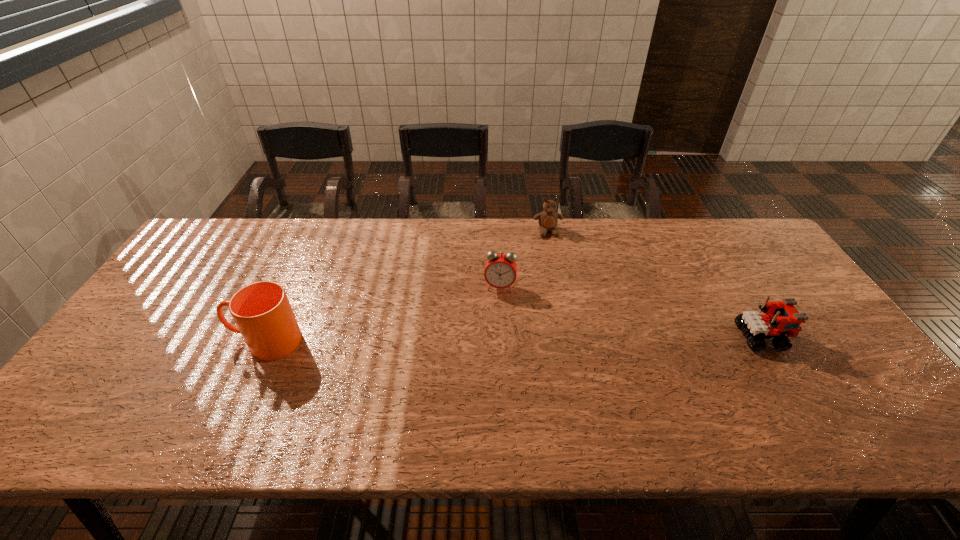
I want to click on mug, so click(262, 312).

This screenshot has height=540, width=960. Find the location of `the leftmost object`. the leftmost object is located at coordinates (262, 312).

The width and height of the screenshot is (960, 540). Find the location of `the rightmost object`. the rightmost object is located at coordinates (782, 318).

Where is `the third object from right to left`? the third object from right to left is located at coordinates (500, 272).

Where is `the third nearest object`? This screenshot has width=960, height=540. the third nearest object is located at coordinates (500, 272).

This screenshot has width=960, height=540. Find the location of `the second object from right to left`. the second object from right to left is located at coordinates (548, 219).

Find the location of `the farthest object`. the farthest object is located at coordinates coord(548,219).

This screenshot has height=540, width=960. Identify the location of free space located on the handle side of the leftmost object. (188, 341).

Find the location of a particular element. The height and width of the screenshot is (540, 960). vacant space situated 0.100m on the handle side of the leftmost object is located at coordinates (192, 341).

I want to click on free space located 0.100m on the handle side of the leftmost object, so click(x=192, y=341).